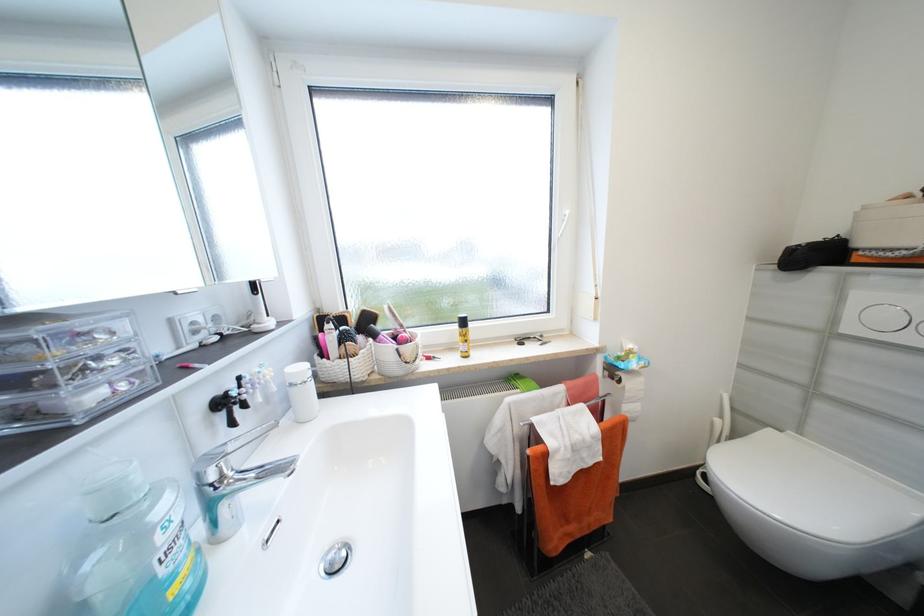
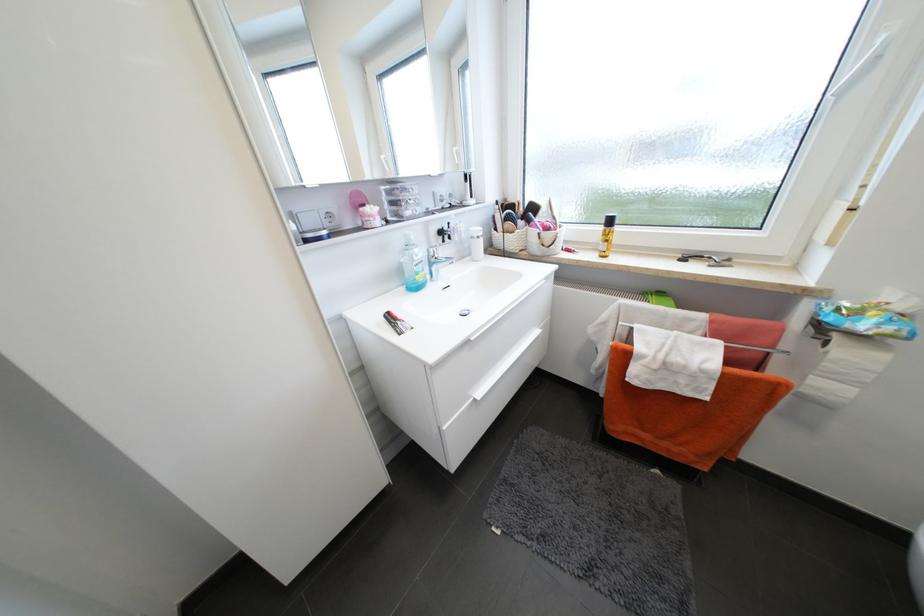
Where in the second image is the point corresponding to (465,357) from the first image?

(602, 256)